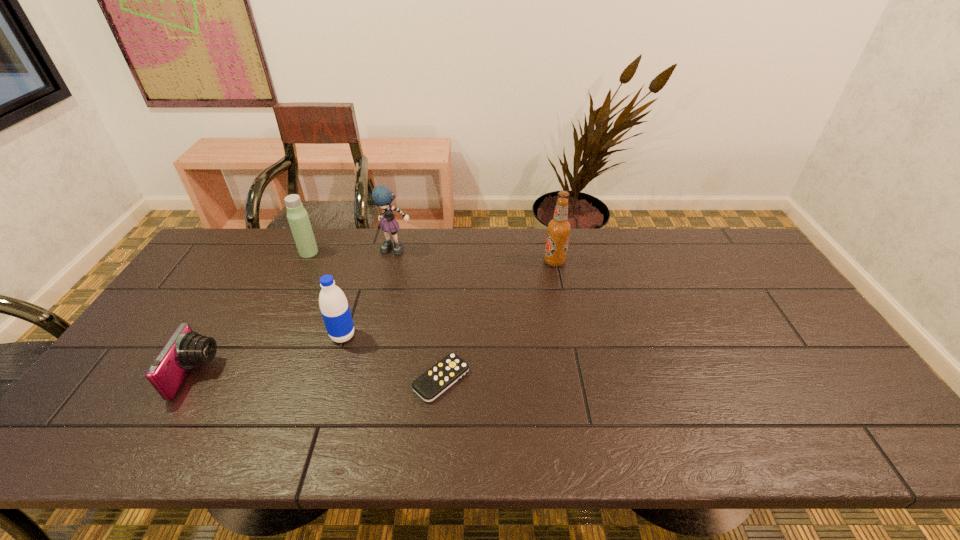
The image size is (960, 540). What are the coordinates of `free space located on the front label of the beer bottle` in the screenshot? It's located at (476, 261).

Where is `vacant region located on the front label of the beer bottle`? This screenshot has height=540, width=960. vacant region located on the front label of the beer bottle is located at coordinates (446, 261).

At what (x,y) coordinates should I click in order to perform the action: click on vacant space positioned 0.160m on the front-facing side of the rag doll. Please return your answer as a coordinate pair (x, y). The height and width of the screenshot is (540, 960). Looking at the image, I should click on (x=388, y=289).

This screenshot has width=960, height=540. I want to click on blank space located 0.350m on the right of the thermos bottle, so click(421, 252).

In order to click on vacant position located 0.250m on the front of the third nearest object in this screenshot , I will do `click(314, 431)`.

This screenshot has height=540, width=960. What are the coordinates of `free space located on the front-facing side of the leftmost object` in the screenshot? It's located at 268,374.

This screenshot has width=960, height=540. I want to click on vacant area located 0.370m on the back of the second object from right to left, so (450, 267).

You are a GUI agent. You are given a task and a screenshot of the screen. Output one action in this format:
    pyautogui.click(x=<x>, y=<y>)
    Task: Click on the beer bottle situated at the far edge
    Image resolution: width=960 pixels, height=540 pixels.
    Given the screenshot: What is the action you would take?
    pyautogui.click(x=558, y=229)

What are the coordinates of `rag doll situated at the far edge` in the screenshot? It's located at (382, 196).

Identify the location of thermos bottle that is at the far edge. (297, 216).